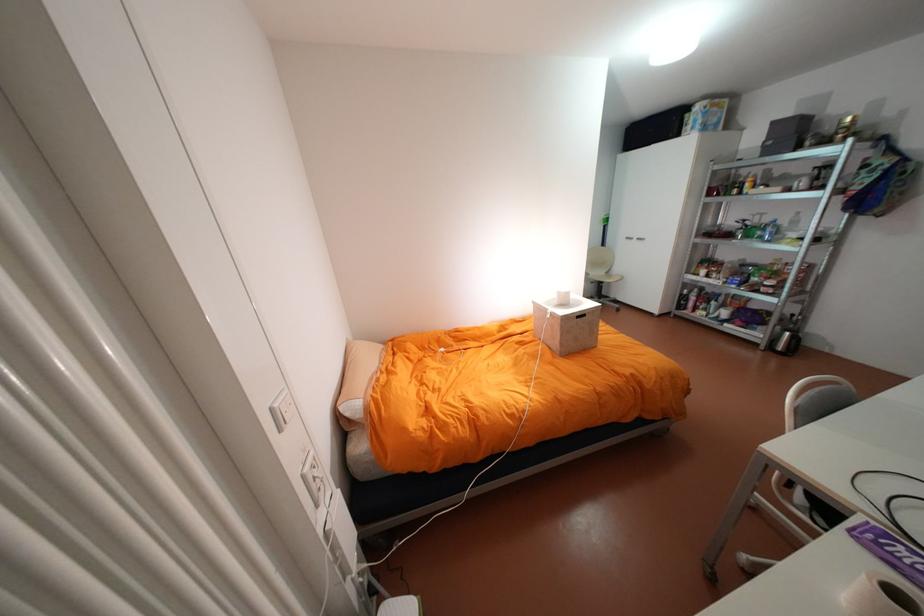
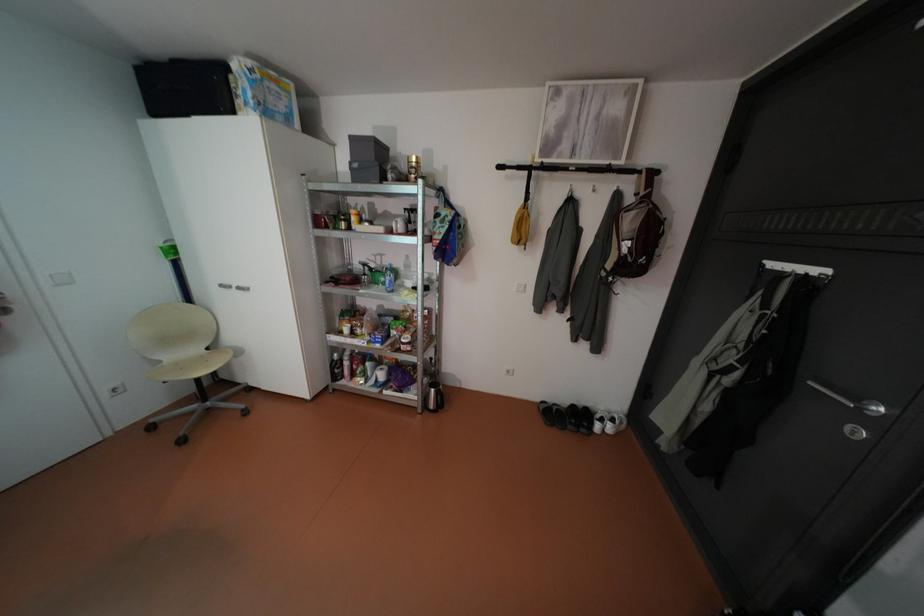
Find the pixel in the second image that matches (636,237) in the first image.

(232, 285)